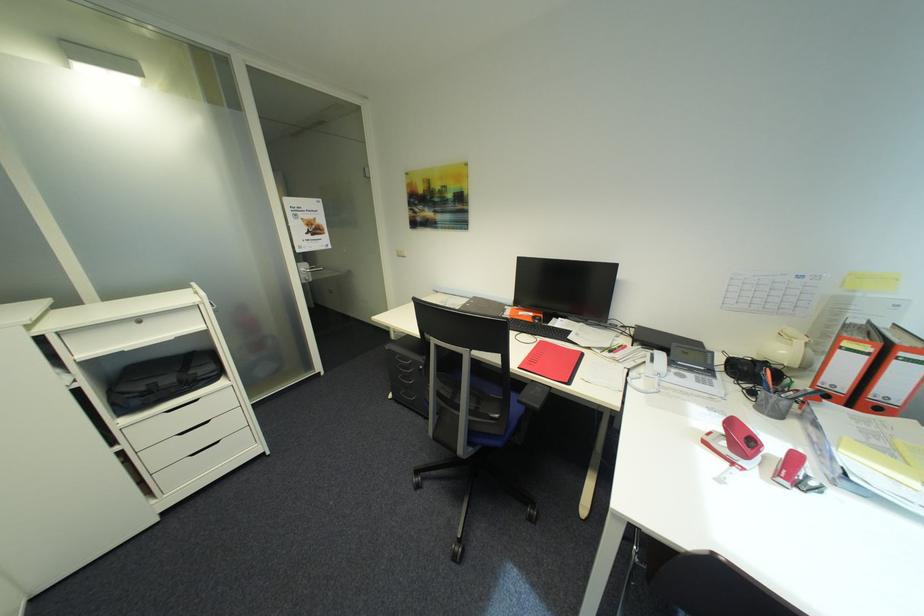
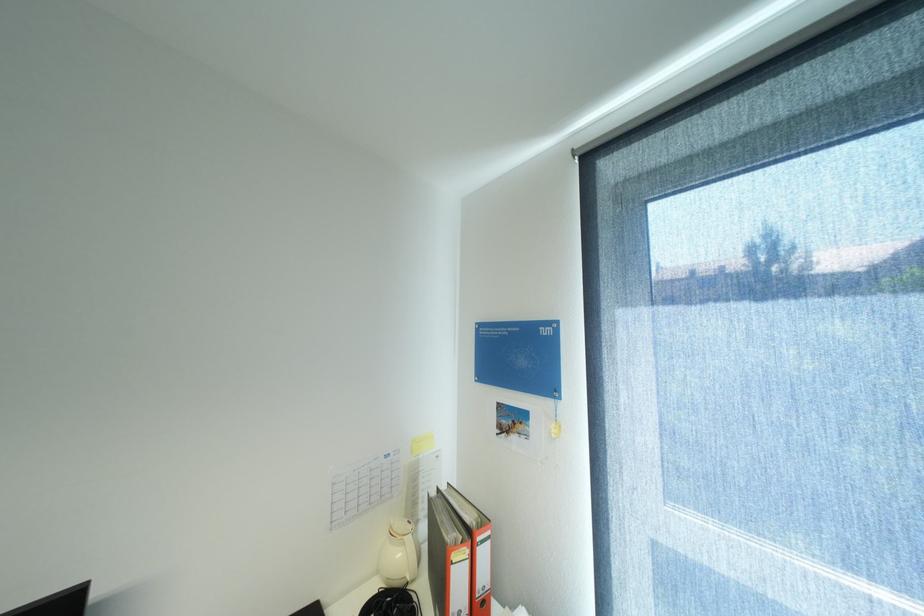
Find the pixel in the second image that matches [793,353] in the first image.

(407, 554)